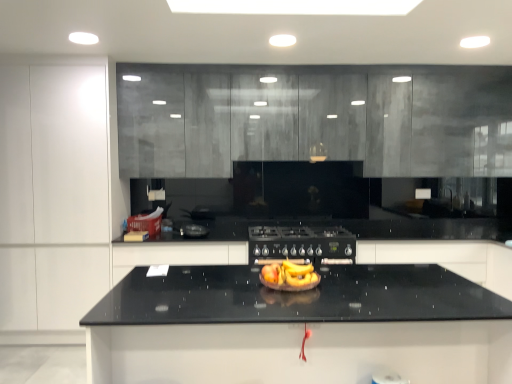
Identify the location of black granite countertop at center, which appears as the first cabinetry when viewed from the right. This screenshot has height=384, width=512. (447, 258).

Describe the element at coordinates (315, 118) in the screenshot. The width and height of the screenshot is (512, 384). I see `matte gray cabinets at upper center, the 3th cabinetry when ordered from left to right` at that location.

Identify the location of black glossy countertop at center, which is the 2th cabinetry from left to right. The width and height of the screenshot is (512, 384). (176, 255).

The image size is (512, 384). Describe the element at coordinates (301, 243) in the screenshot. I see `black matte gas stove at center` at that location.

Where is `black granite countertop at center`? black granite countertop at center is located at coordinates (298, 327).

From the image's perspective, between black granite countertop at center and yellow matte bananas at center, which one is located above?

yellow matte bananas at center is shown above in the image.

Is black granite countertop at center located outside yellow matte bananas at center?

Yes.

The height and width of the screenshot is (384, 512). Find the location of `food that is above the black granite countertop at center (from a real-world perspective)`. food that is above the black granite countertop at center (from a real-world perspective) is located at coordinates (289, 276).

Can you confirm if black granite countertop at center is positioned to the left of yellow matte bananas at center?

No.

The height and width of the screenshot is (384, 512). Identify the location of countertop that appears on the right of yellow matte bananas at center. (298, 327).

Looking at this image, is yellow matte bananas at center bigger or smaller than black granite countertop at center?

Clearly, yellow matte bananas at center is smaller in size than black granite countertop at center.

Is point (302, 289) positioned before point (178, 318)?

No, it is behind (178, 318).

From the image's perspective, is yellow matte bananas at center on top of black granite countertop at center?

Yes, from the image's perspective, yellow matte bananas at center is above black granite countertop at center.

Between black granite countertop at center, arranged as the fourth cabinetry when viewed from the left, and black glossy countertop at center, placed as the third cabinetry when sorted from right to left, which one is positioned in front?

black glossy countertop at center, placed as the third cabinetry when sorted from right to left.

Is black granite countertop at center, which appears as the first cabinetry when viewed from the right, situated inside black glossy countertop at center, which is the 2th cabinetry from left to right, or outside?

black granite countertop at center, which appears as the first cabinetry when viewed from the right, lies outside black glossy countertop at center, which is the 2th cabinetry from left to right.

From the image's perspective, which object appears higher, black granite countertop at center, which appears as the first cabinetry when viewed from the right, or black glossy countertop at center, which is the 2th cabinetry from left to right?

black granite countertop at center, which appears as the first cabinetry when viewed from the right.

Looking at this image, can you tell me how much black granite countertop at center, arranged as the fourth cabinetry when viewed from the left, and black glossy countertop at center, which is the 2th cabinetry from left to right, differ in facing direction?

The angle between the facing direction of black granite countertop at center, arranged as the fourth cabinetry when viewed from the left, and the facing direction of black glossy countertop at center, which is the 2th cabinetry from left to right, is 0.000304 degrees.

Is yellow matte bananas at center taller than white matte cabinet at left, which ranks as the 4th cabinetry in right-to-left order?

No.

Relative to white matte cabinet at left, which ranks as the 1th cabinetry in left-to-right order, is yellow matte bananas at center in front or behind?

In the image, yellow matte bananas at center appears in front of white matte cabinet at left, which ranks as the 1th cabinetry in left-to-right order.

Which of these two, yellow matte bananas at center or white matte cabinet at left, which ranks as the 1th cabinetry in left-to-right order, is thinner?

yellow matte bananas at center.

Considering the relative sizes of matte gray cabinets at upper center, the 3th cabinetry when ordered from left to right, and black glossy countertop at center, which is the 2th cabinetry from left to right, in the image provided, is matte gray cabinets at upper center, the 3th cabinetry when ordered from left to right, thinner than black glossy countertop at center, which is the 2th cabinetry from left to right,?

Yes.

Is matte gray cabinets at upper center, which is counted as the second cabinetry, starting from the right, facing towards black glossy countertop at center, which is the 2th cabinetry from left to right?

No, matte gray cabinets at upper center, which is counted as the second cabinetry, starting from the right, is not turned towards black glossy countertop at center, which is the 2th cabinetry from left to right.

Which is closer to the camera, (255, 122) or (214, 245)?

The point (214, 245) is closer.

From the image's perspective, which object appears higher, matte gray cabinets at upper center, the 3th cabinetry when ordered from left to right, or black glossy countertop at center, placed as the third cabinetry when sorted from right to left?

matte gray cabinets at upper center, the 3th cabinetry when ordered from left to right, from the image's perspective.

From the image's perspective, would you say white matte cabinet at left, which ranks as the 4th cabinetry in right-to-left order, is positioned over black granite countertop at center, which appears as the first cabinetry when viewed from the right?

Correct, white matte cabinet at left, which ranks as the 4th cabinetry in right-to-left order, appears higher than black granite countertop at center, which appears as the first cabinetry when viewed from the right, in the image.

From a real-world perspective, is white matte cabinet at left, which ranks as the 1th cabinetry in left-to-right order, located beneath black granite countertop at center, which appears as the first cabinetry when viewed from the right?

No, from a real-world perspective, white matte cabinet at left, which ranks as the 1th cabinetry in left-to-right order, is not below black granite countertop at center, which appears as the first cabinetry when viewed from the right.

Considering the points (18, 100) and (465, 249), which point is behind, point (18, 100) or point (465, 249)?

The point (465, 249) is behind.

Which of these two, black granite countertop at center or white matte cabinet at left, which ranks as the 1th cabinetry in left-to-right order, is bigger?

Bigger between the two is white matte cabinet at left, which ranks as the 1th cabinetry in left-to-right order.

From a real-world perspective, count 3rd cabinetrys upward from the black granite countertop at center and point to it. Please provide its 2D coordinates.

[(53, 194)]

Identify the location of food on the left of black granite countertop at center. (289, 276).

Image resolution: width=512 pixels, height=384 pixels. What are the coordinates of `countertop lying in front of the yellow matte bananas at center` in the screenshot? It's located at (298, 327).

Which object lies further to the anchor point white matte cabinet at left, which ranks as the 1th cabinetry in left-to-right order, matte gray cabinets at upper center, which is counted as the second cabinetry, starting from the right, or black granite countertop at center?

Among the two, black granite countertop at center is located further to white matte cabinet at left, which ranks as the 1th cabinetry in left-to-right order.

From the image, which object appears to be farther from black granite countertop at center, which appears as the first cabinetry when viewed from the right, matte gray cabinets at upper center, which is counted as the second cabinetry, starting from the right, or yellow matte bananas at center?

Among the two, yellow matte bananas at center is located further to black granite countertop at center, which appears as the first cabinetry when viewed from the right.

When comparing their distances from black granite countertop at center, does black granite countertop at center, which appears as the first cabinetry when viewed from the right, or black matte gas stove at center seem closer?

black matte gas stove at center lies closer to black granite countertop at center than the other object.

From the image, which object appears to be farther from black granite countertop at center, arranged as the fourth cabinetry when viewed from the left, black glossy countertop at center, placed as the third cabinetry when sorted from right to left, or matte gray cabinets at upper center, the 3th cabinetry when ordered from left to right?

black glossy countertop at center, placed as the third cabinetry when sorted from right to left.

Considering their positions, is matte gray cabinets at upper center, the 3th cabinetry when ordered from left to right, positioned further to black glossy countertop at center, which is the 2th cabinetry from left to right, than yellow matte bananas at center?

yellow matte bananas at center is further to black glossy countertop at center, which is the 2th cabinetry from left to right.

Considering their positions, is black glossy countertop at center, placed as the third cabinetry when sorted from right to left, positioned closer to matte gray cabinets at upper center, which is counted as the second cabinetry, starting from the right, than yellow matte bananas at center?

Among the two, black glossy countertop at center, placed as the third cabinetry when sorted from right to left, is located nearer to matte gray cabinets at upper center, which is counted as the second cabinetry, starting from the right.

Considering their positions, is black glossy countertop at center, which is the 2th cabinetry from left to right, positioned further to matte gray cabinets at upper center, the 3th cabinetry when ordered from left to right, than white matte cabinet at left, which ranks as the 1th cabinetry in left-to-right order?

black glossy countertop at center, which is the 2th cabinetry from left to right.

Which object lies further to the anchor point black granite countertop at center, which appears as the first cabinetry when viewed from the right, black matte gas stove at center or black granite countertop at center?

Based on the image, black granite countertop at center appears to be further to black granite countertop at center, which appears as the first cabinetry when viewed from the right.

This screenshot has height=384, width=512. What are the coordinates of `appliance located between black granite countertop at center and black granite countertop at center, arranged as the fourth cabinetry when viewed from the left, in the depth direction` in the screenshot? It's located at pyautogui.click(x=301, y=243).

The image size is (512, 384). I want to click on appliance located between white matte cabinet at left, which ranks as the 1th cabinetry in left-to-right order, and black granite countertop at center, which appears as the first cabinetry when viewed from the right, in the left-right direction, so click(301, 243).

The image size is (512, 384). I want to click on food positioned between black granite countertop at center and black glossy countertop at center, which is the 2th cabinetry from left to right, from near to far, so click(289, 276).

This screenshot has height=384, width=512. I want to click on countertop located between white matte cabinet at left, which ranks as the 1th cabinetry in left-to-right order, and black granite countertop at center, arranged as the fourth cabinetry when viewed from the left, in the left-right direction, so click(298, 327).